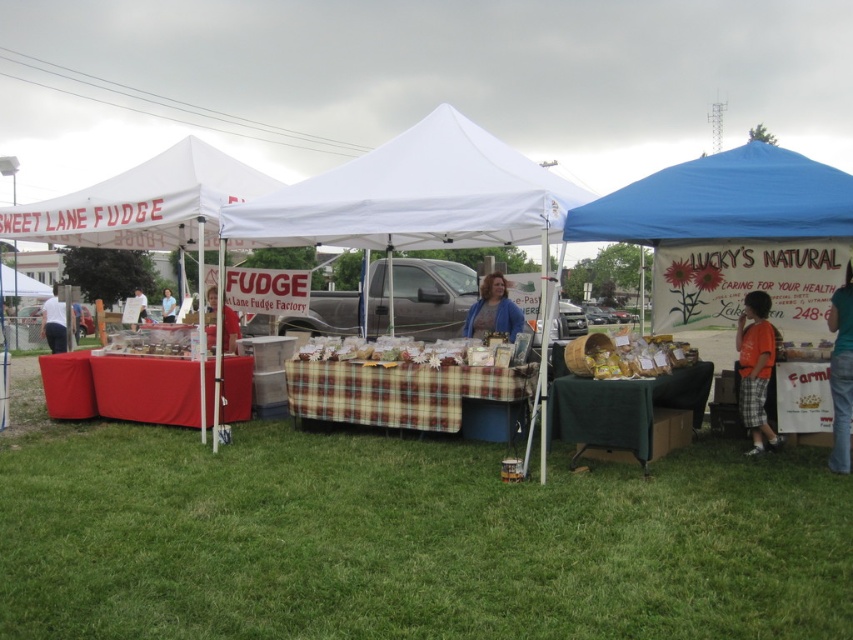
Question: Considering the real-world distances, which object is closest to the green fabric table at lower right?

Choices:
 (A) plaid fabric tablecloth at center
 (B) plaid fabric basket at center

Answer: (B)

Question: Among these points, which one is farthest from the camera?

Choices:
 (A) (625, 344)
 (B) (833, 465)
 (C) (171, 292)

Answer: (C)

Question: Which of the following is the closest to the observer?

Choices:
 (A) (163, 298)
 (B) (694, 168)
 (C) (64, 636)

Answer: (C)

Question: Considering the relative positions of green grass at lower center and white fabric tent at left in the image provided, where is green grass at lower center located with respect to white fabric tent at left?

Choices:
 (A) right
 (B) left

Answer: (A)

Question: Is green grass at lower center in front of light blue shirt at center?

Choices:
 (A) yes
 (B) no

Answer: (A)

Question: Observing the image, what is the correct spatial positioning of green grass at lower center in reference to white fabric canopy at upper left?

Choices:
 (A) left
 (B) right

Answer: (B)